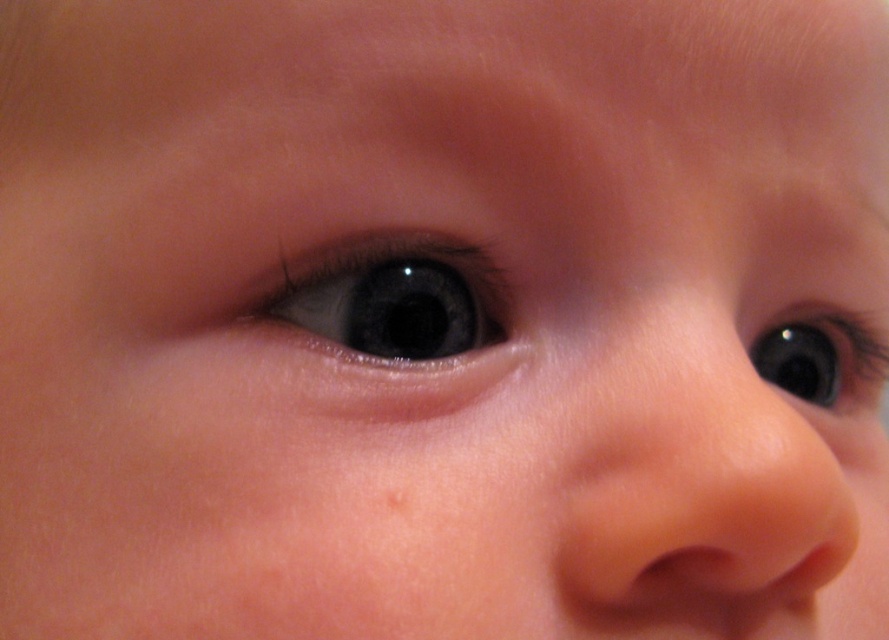
You are a photographer adjusting your camera settings to capture a close focus on the baby. The camera is positioned at a certain distance from the baby. If you want to maintain the same level of focus on the baby, what should you do if you move the camera closer to the point at point (450,282)?

Since the distance between the camera and point (450,282) is 27.76 centimeters, moving the camera closer would require adjusting the focus to ensure sharpness. To maintain the same level of focus, you should decrease the focus distance setting to match the new shorter distance between the camera and the point (450,282).